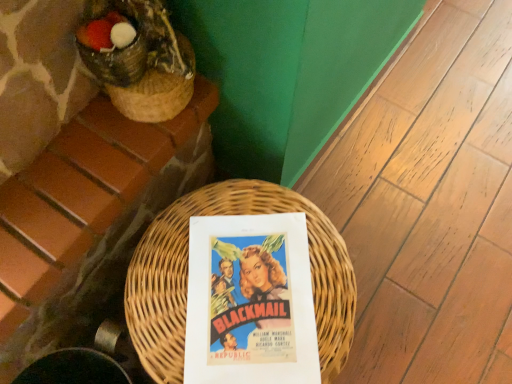
Locate an element on the screen. empty space that is ontop of matte paper poster at center (from a real-world perspective) is located at coordinates [252, 305].